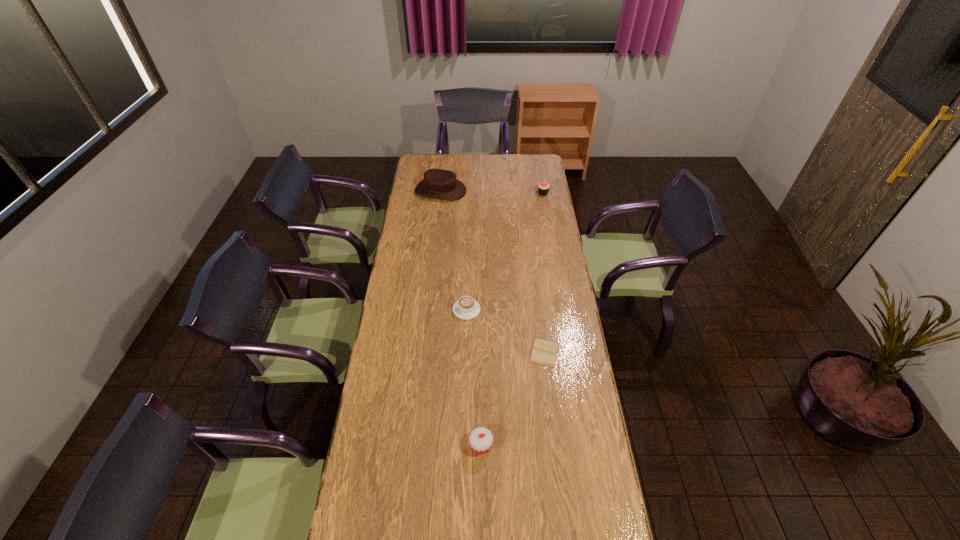
At what (x,y) coordinates should I click in order to perform the action: click on vacant area that lies between the hat and the diary. Please return your answer as a coordinate pair (x, y). The width and height of the screenshot is (960, 540). Looking at the image, I should click on (492, 272).

What are the coordinates of `unoccupied position between the tallest object and the right cupcake` in the screenshot? It's located at (492, 192).

You are a GUI agent. You are given a task and a screenshot of the screen. Output one action in this format:
    pyautogui.click(x=<x>, y=<y>)
    Task: Click on the vacant area that lies between the shortest object and the hat
    Image resolution: width=960 pixels, height=540 pixels.
    Given the screenshot: What is the action you would take?
    pyautogui.click(x=492, y=272)

Image resolution: width=960 pixels, height=540 pixels. I want to click on vacant point located between the second shortest object and the second nearest object, so click(x=506, y=331).

Find the location of a particular element. free spot between the shortest object and the tallest object is located at coordinates (492, 272).

Identify the location of vacant region between the second shortest object and the hat. The image size is (960, 540). (454, 250).

The width and height of the screenshot is (960, 540). I want to click on free spot between the right cupcake and the tallest object, so click(x=492, y=192).

The width and height of the screenshot is (960, 540). What are the coordinates of `free space that is in between the hat and the third nearest object` in the screenshot? It's located at (454, 250).

Locate an element on the screen. The height and width of the screenshot is (540, 960). free spot between the nearest object and the diary is located at coordinates (513, 399).

Select which object appears as the fourth closest to the diary. Please provide its 2D coordinates. Your answer should be formatted as a tuple, i.e. [(x, y)], where the tuple contains the x and y coordinates of a point satisfying the conditions above.

[(543, 187)]